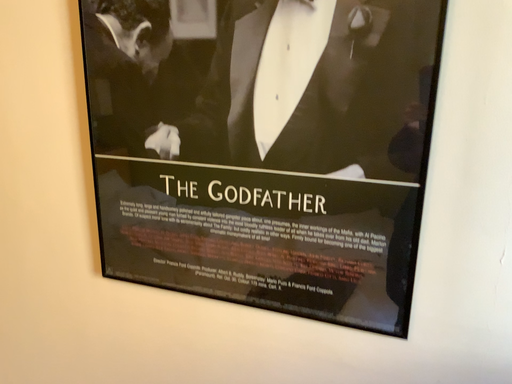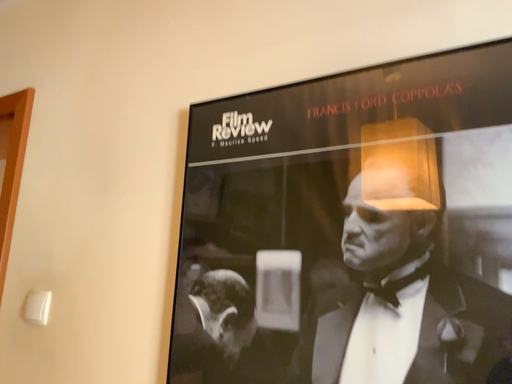
Question: Which way did the camera rotate in the video?

Choices:
 (A) rotated upward
 (B) rotated downward

Answer: (A)